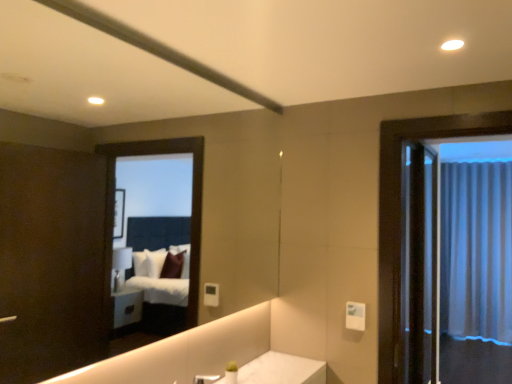
Question: From the image's perspective, is clear glass screen door at right on white sheer curtain at right?

Choices:
 (A) yes
 (B) no

Answer: (A)

Question: Is clear glass screen door at right aimed at white sheer curtain at right?

Choices:
 (A) yes
 (B) no

Answer: (B)

Question: Considering the relative sizes of clear glass screen door at right and white sheer curtain at right in the image provided, is clear glass screen door at right bigger than white sheer curtain at right?

Choices:
 (A) yes
 (B) no

Answer: (B)

Question: Does clear glass screen door at right lie behind white sheer curtain at right?

Choices:
 (A) yes
 (B) no

Answer: (B)

Question: From the image's perspective, does clear glass screen door at right appear lower than white sheer curtain at right?

Choices:
 (A) no
 (B) yes

Answer: (A)

Question: Is white sheer curtain at right inside clear glass screen door at right?

Choices:
 (A) yes
 (B) no

Answer: (B)

Question: Is white sheer curtain at right behind clear glass screen door at right?

Choices:
 (A) yes
 (B) no

Answer: (A)

Question: Is clear glass screen door at right at the back of white sheer curtain at right?

Choices:
 (A) yes
 (B) no

Answer: (B)

Question: Is there a large distance between white sheer curtain at right and clear glass screen door at right?

Choices:
 (A) no
 (B) yes

Answer: (A)

Question: From a real-world perspective, is white sheer curtain at right located beneath clear glass screen door at right?

Choices:
 (A) yes
 (B) no

Answer: (A)

Question: Does white sheer curtain at right appear on the right side of clear glass screen door at right?

Choices:
 (A) no
 (B) yes

Answer: (B)

Question: Is white sheer curtain at right completely or partially outside of clear glass screen door at right?

Choices:
 (A) no
 (B) yes

Answer: (B)

Question: From the image's perspective, is silver metallic faucet at lower center on top of white sheer curtain at right?

Choices:
 (A) yes
 (B) no

Answer: (A)